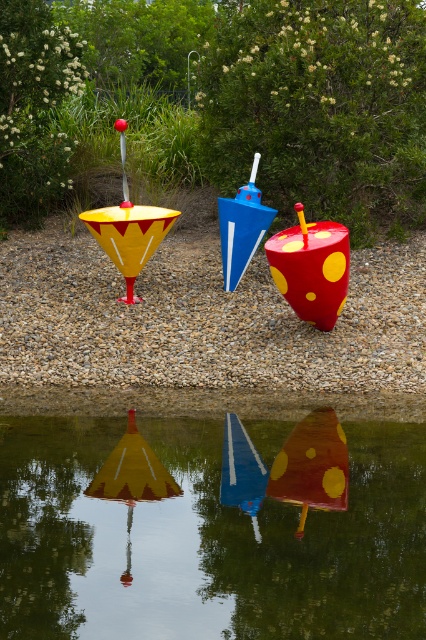
Between matte yellow and red plastic umbrella at center and blue glossy sign at center, which one has less height?

blue glossy sign at center is shorter.

Is matte yellow and red plastic umbrella at center above blue glossy sign at center?

Indeed, matte yellow and red plastic umbrella at center is positioned over blue glossy sign at center.

Locate an element on the screen. Image resolution: width=426 pixels, height=640 pixels. matte yellow and red plastic umbrella at center is located at coordinates (129, 228).

Who is higher up, yellow striped cone at center or blue glossy cone at center?

blue glossy cone at center is higher up.

Does point (132, 467) come behind point (258, 157)?

That is False.

Find the location of `yellow striped cone at center`. yellow striped cone at center is located at coordinates (132, 480).

Between glossy water at center and matte yellow and red polka dot cone at center, which one is positioned lower?

glossy water at center is below.

Does glossy water at center have a larger size compared to matte yellow and red polka dot cone at center?

Correct, glossy water at center is larger in size than matte yellow and red polka dot cone at center.

What do you see at coordinates (213, 525) in the screenshot? Image resolution: width=426 pixels, height=640 pixels. I see `glossy water at center` at bounding box center [213, 525].

What are the coordinates of `glossy water at center` in the screenshot? It's located at (213, 525).